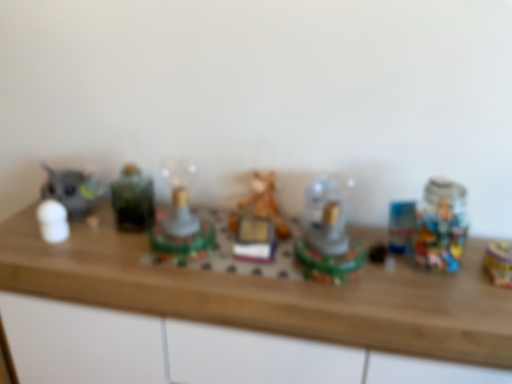
At what (x,y) coordinates should I click in order to perform the action: click on vacant area that is in front of translucent plastic toy at center, which is counted as the sixth toy, starting from the left. Please return your answer as a coordinate pair (x, y). This screenshot has height=384, width=512. Looking at the image, I should click on (349, 304).